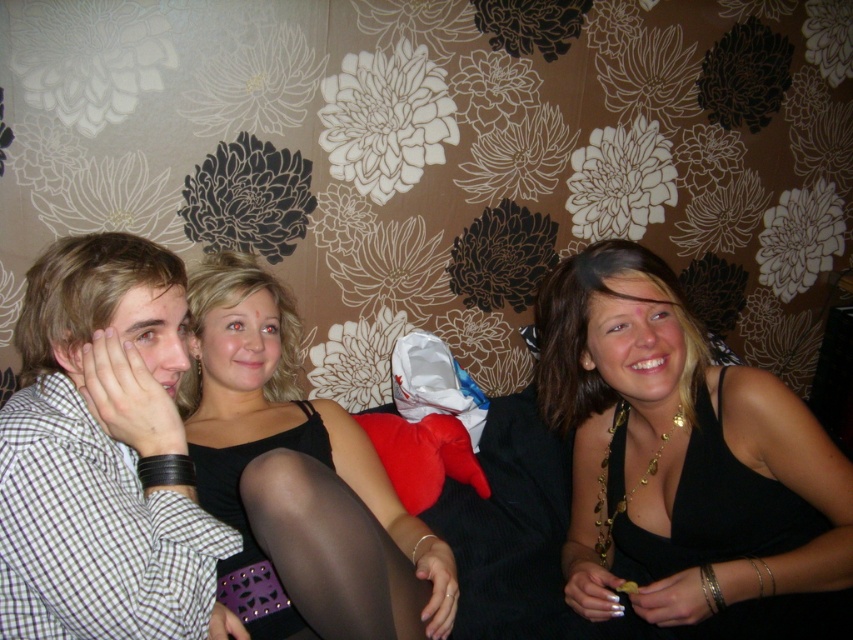
Who is lower down, black satin tank top at center or black matte tank top at center?

black matte tank top at center is below.

Does point (662, 371) come farther from viewer compared to point (407, 577)?

Yes, point (662, 371) is farther from viewer.

Find the location of a particular element. black satin tank top at center is located at coordinates (685, 465).

Who is more forward, (741,508) or (126,333)?

Point (126,333) is more forward.

Does point (639, 554) lie behind point (128, 573)?

Yes, point (639, 554) is farther from viewer.

Between point (592, 276) and point (45, 445), which one is positioned in front?

Point (45, 445) is more forward.

Find the location of a particular element. black satin tank top at center is located at coordinates (685, 465).

Between point (47, 330) and point (252, 605), which one is positioned in front?

Point (47, 330) is more forward.

Where is `checkered fabric shirt at left`? checkered fabric shirt at left is located at coordinates (97, 460).